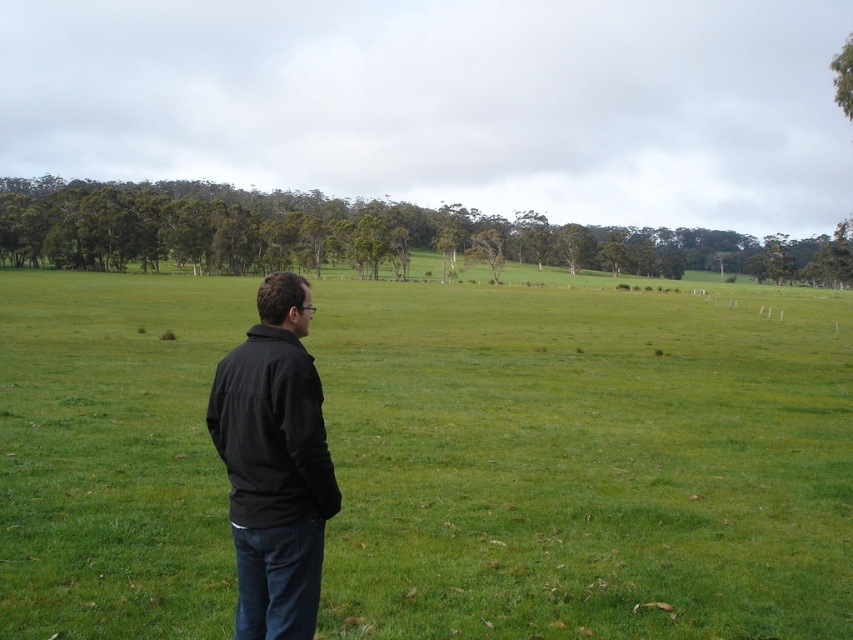
Between black matte jacket at left and green leafy tree at upper right, which one appears on the right side from the viewer's perspective?

green leafy tree at upper right is more to the right.

Does point (242, 572) lie in front of point (843, 52)?

Yes, point (242, 572) is in front of point (843, 52).

Who is more forward, (294, 476) or (834, 54)?

→ Point (294, 476) is in front.

I want to click on black matte jacket at left, so click(274, 465).

Consider the image. Which of these two, green leafy trees at center or green leafy tree at upper right, stands shorter?

green leafy trees at center

Which is more to the left, green leafy trees at center or green leafy tree at upper right?

green leafy trees at center

Is point (312, 236) more distant than point (833, 70)?

No.

Identify the location of green leafy trees at center. Image resolution: width=853 pixels, height=640 pixels. [x=360, y=234].

Based on the photo, is green grass pasture at center shorter than green leafy tree at upper right?

Indeed, green grass pasture at center has a lesser height compared to green leafy tree at upper right.

This screenshot has width=853, height=640. I want to click on green grass pasture at center, so click(x=585, y=461).